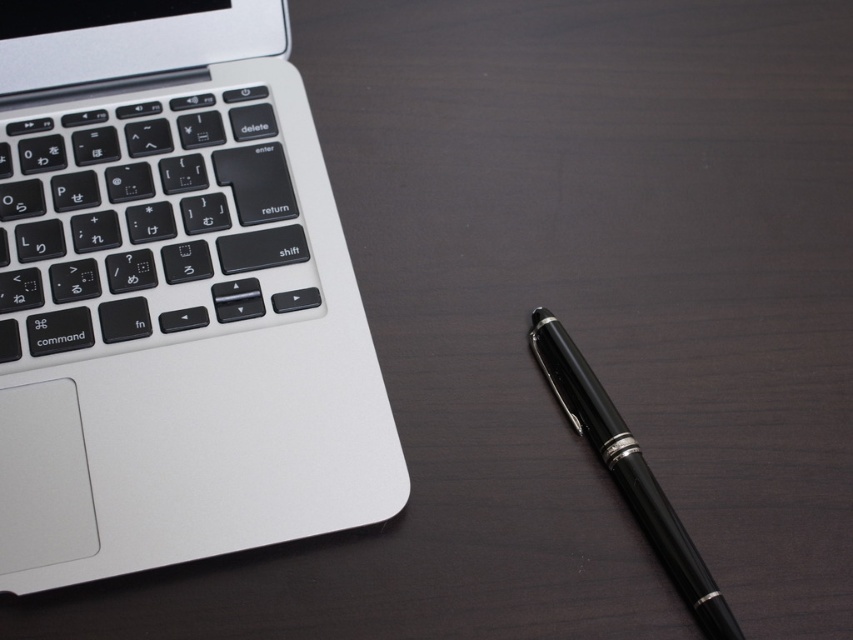
You are organizing a workspace and need to place both the sleek silver laptop at upper left and the black polished pen at lower right on a narrow shelf. The shelf can only accommodate items that are no wider than the pen. Can both items fit side by side on the shelf?

The sleek silver laptop at upper left is wider than the black polished pen at lower right. Since the shelf can only accommodate items no wider than the pen, the laptop is too wide to fit. Therefore, both items cannot fit side by side on the shelf.

You are trying to reach for the sleek silver laptop at upper left and the black matte keyboard at left. Which one can you grab first without moving your hand?

The sleek silver laptop at upper left is closer to the viewer than the black matte keyboard at left, so you can grab it first without moving your hand.

In the scene shown: You are trying to place a smartphone between the sleek silver laptop at upper left and the black matte keyboard at left. Given that the smartphone is 7 cm wide, can it fit in the space between them?

The sleek silver laptop at upper left is wider than the black matte keyboard at left. However, the exact width difference isn t specified, so it s impossible to determine if the 7 cm smartphone will fit between them based on the provided information.